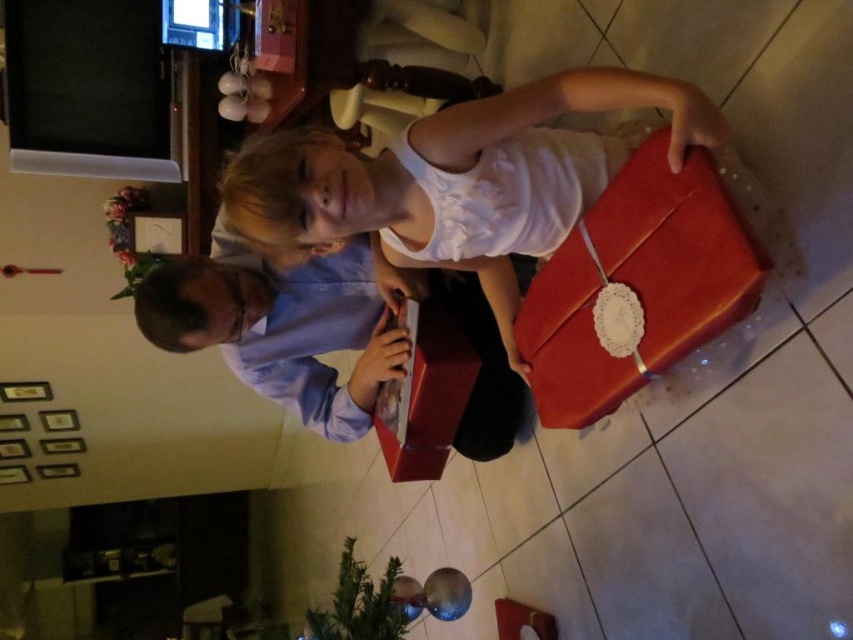
You are a photographer trying to capture a photo of both the matte white shirt at center and the matte blue shirt at center. Since you want them to appear side by side in the photo, which shirt should you position to the left to ensure they are both visible in the frame?

The matte white shirt at center is positioned on the right side of matte blue shirt at center. To have them side by side in the photo, position the matte blue shirt at center to the left so that the matte white shirt at center is on its right, ensuring both are visible.

You are a photographer trying to capture a photo of the two people in the scene. Since both the matte white shirt at center and the matte blue shirt at center are in the same area, which one will be more visible in the photo?

The matte white shirt at center is positioned over matte blue shirt at center, so the matte white shirt at center will be more visible in the photo because it is in front.